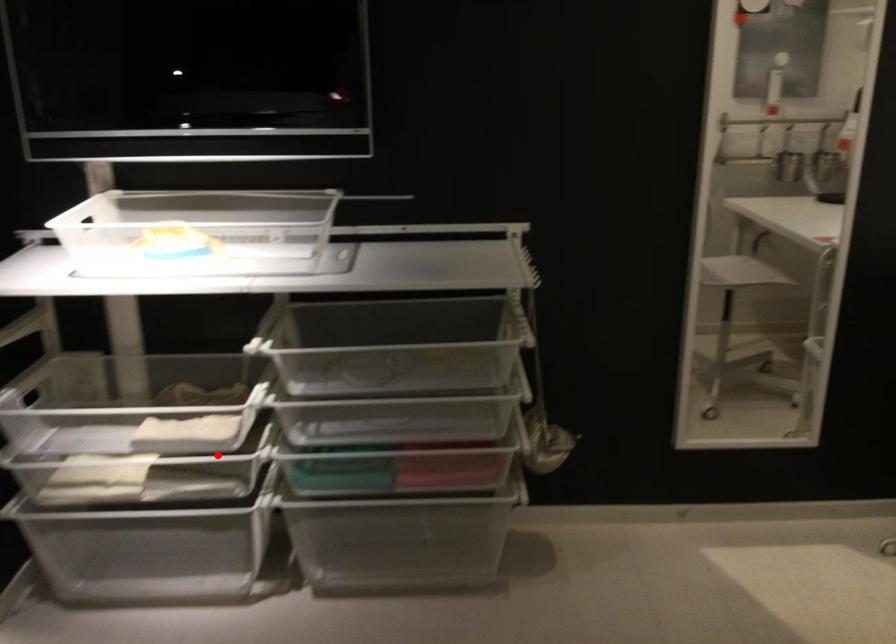
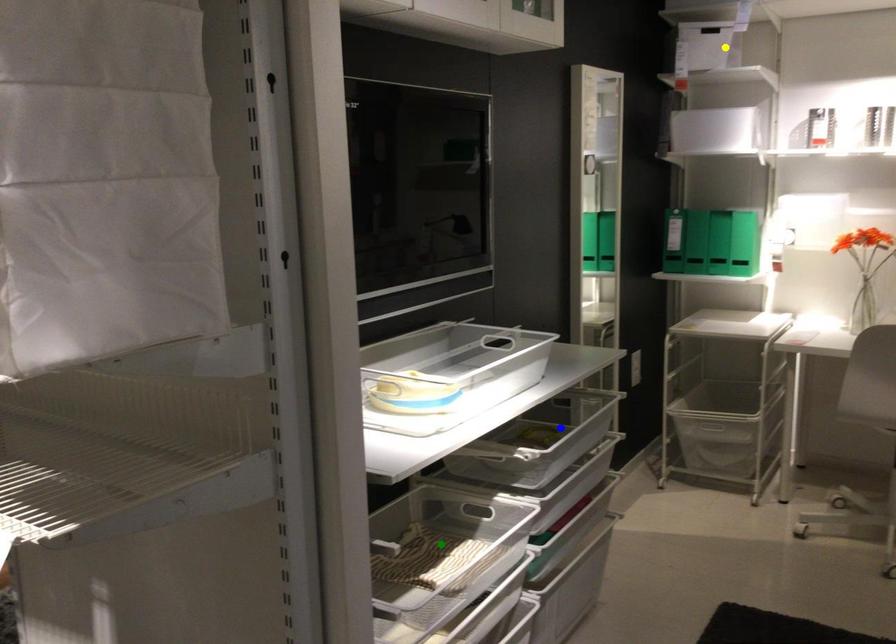
Question: I am providing you with two images of the same scene from different viewpoints. A red point is marked on the first image. You are given multiple points on the second image. Which spot in image 2 lines up with the point in image 1?

Choices:
 (A) green point
 (B) blue point
 (C) yellow point

Answer: (A)